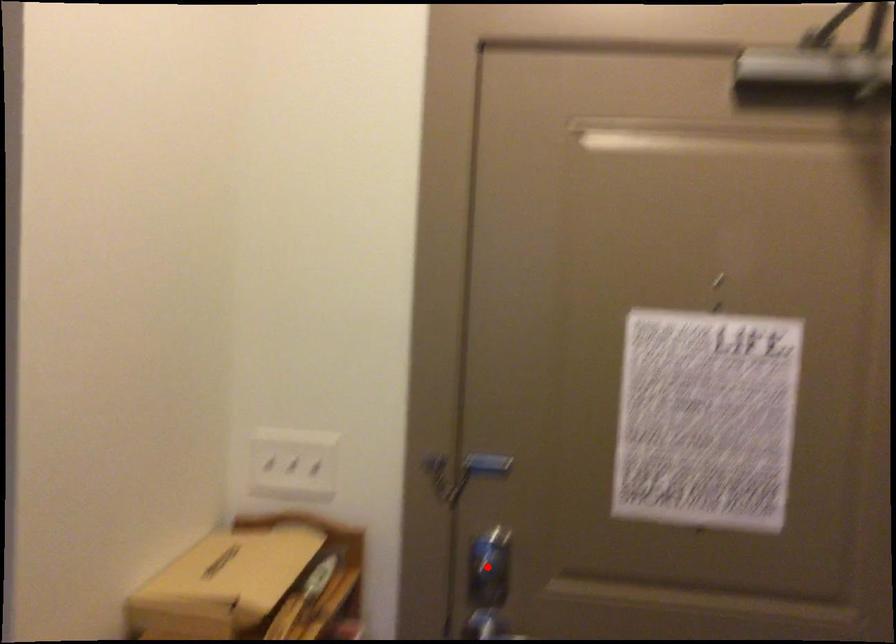
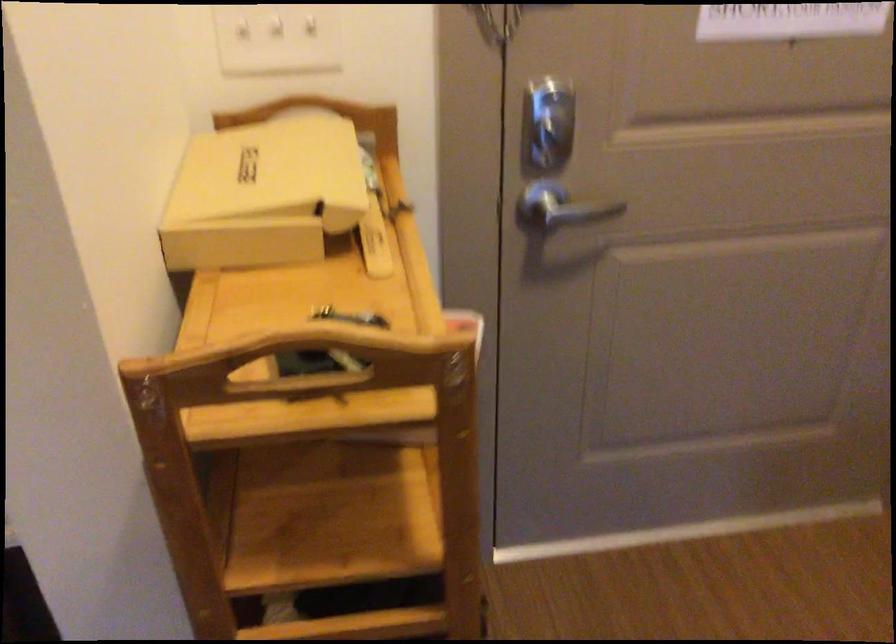
Find the pixel in the second image that matches the highlighted location in the first image.

(547, 122)